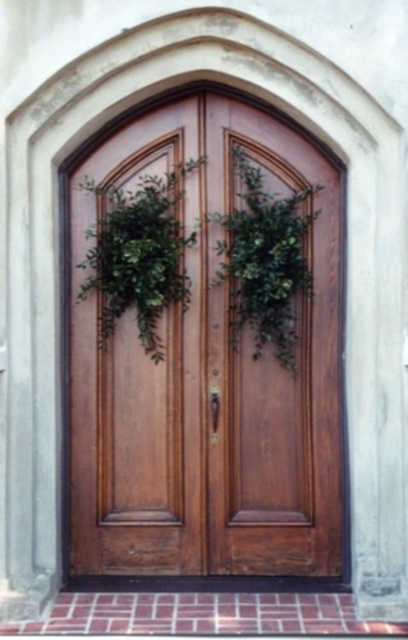
Question: Is wooden door at center below green leafy wreath at center?

Choices:
 (A) no
 (B) yes

Answer: (B)

Question: Which point is closer to the camera?

Choices:
 (A) green leafy wreath at center
 (B) green leafy plant at center
 (C) wooden door at center

Answer: (B)

Question: Is wooden door at center positioned behind green leafy wreath at center?

Choices:
 (A) yes
 (B) no

Answer: (A)

Question: Is green leafy wreath at center bigger than green leafy plant at center?

Choices:
 (A) no
 (B) yes

Answer: (A)

Question: Which object is the closest to the green leafy wreath at center?

Choices:
 (A) green leafy plant at center
 (B) wooden door at center

Answer: (B)

Question: Estimate the real-world distances between objects in this image. Which object is closer to the wooden door at center?

Choices:
 (A) green leafy plant at center
 (B) green leafy wreath at center

Answer: (A)